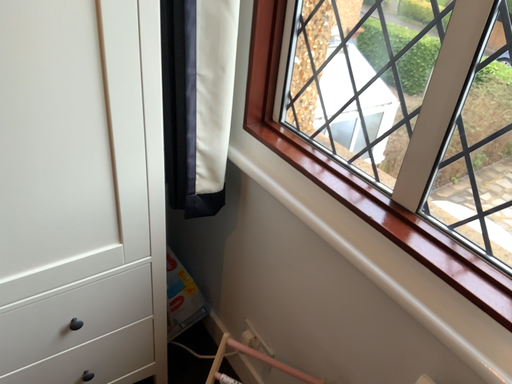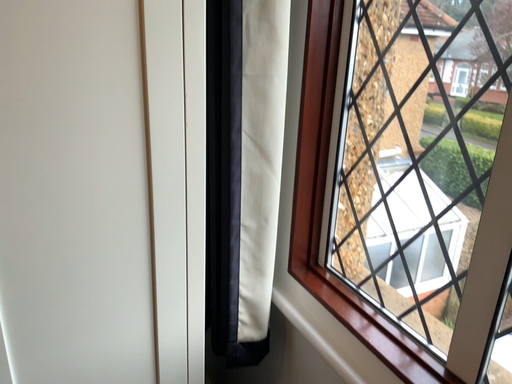
Question: Which way did the camera rotate in the video?

Choices:
 (A) rotated left
 (B) rotated right

Answer: (A)